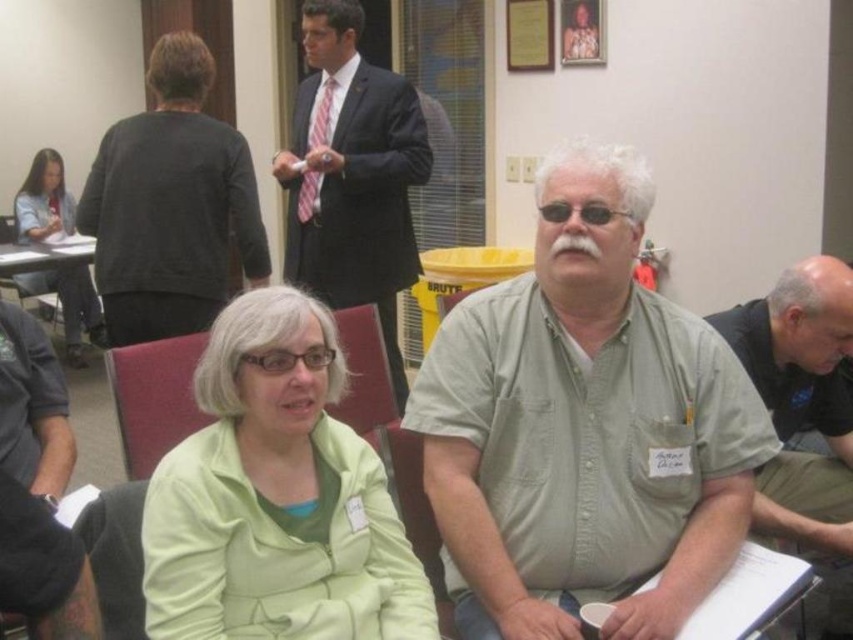
Question: Based on their relative distances, which object is nearer to the gray shirt at center?

Choices:
 (A) matte black jacket at left
 (B) dark gray sweater at upper left
 (C) green fabric chair at center

Answer: (C)

Question: Does dark gray sweater at upper left have a smaller size compared to gray fabric shirt at lower left?

Choices:
 (A) no
 (B) yes

Answer: (A)

Question: Observing the image, what is the correct spatial positioning of dark gray sweater at upper left in reference to gray fabric shirt at lower left?

Choices:
 (A) left
 (B) right

Answer: (B)

Question: Is green zip-up jacket at center closer to the viewer compared to gray shirt at center?

Choices:
 (A) yes
 (B) no

Answer: (A)

Question: Which point appears closest to the camera in this image?

Choices:
 (A) (57, 273)
 (B) (178, 163)

Answer: (B)

Question: Which point is farther to the camera?

Choices:
 (A) (30, 456)
 (B) (642, 637)
 (C) (355, 595)

Answer: (A)